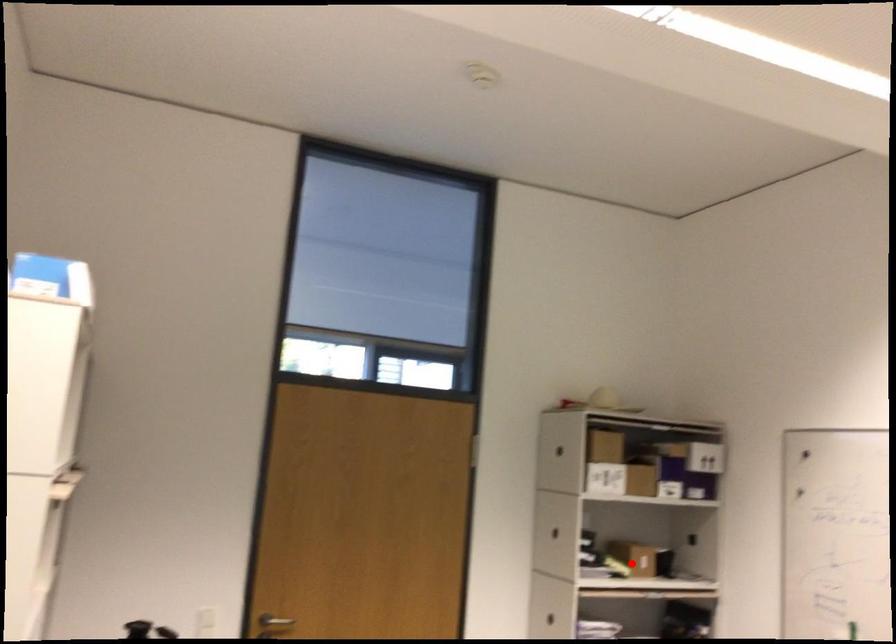
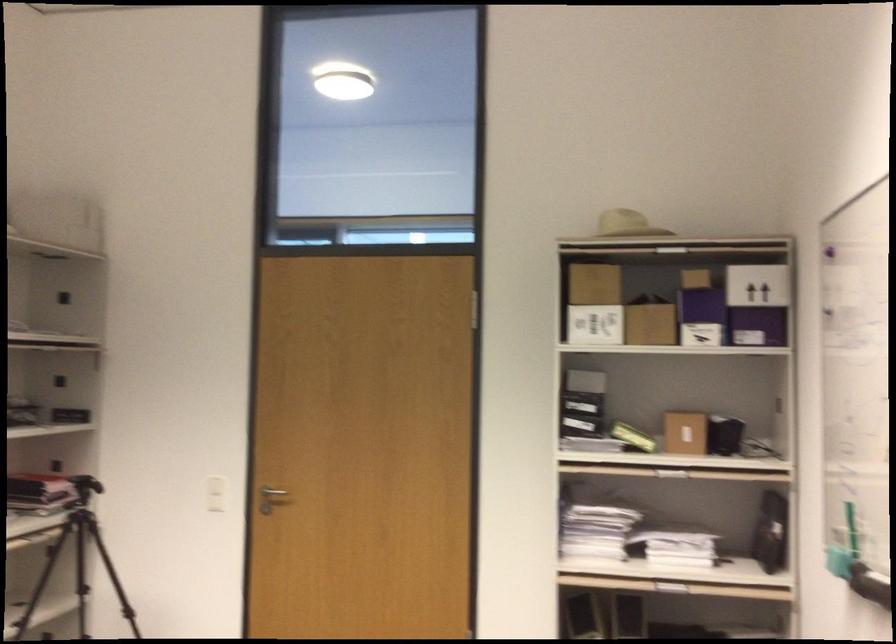
Question: I am providing you with two images of the same scene from different viewpoints. In image1, a red point is highlighted. Considering the same 3D point in image2, which of the following is correct?

Choices:
 (A) It is closer
 (B) It is farther

Answer: (A)